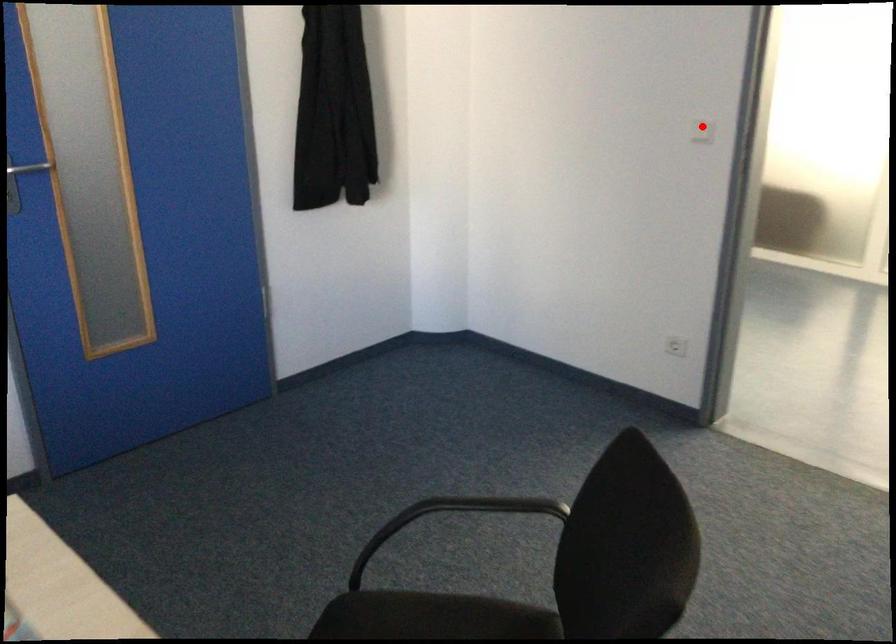
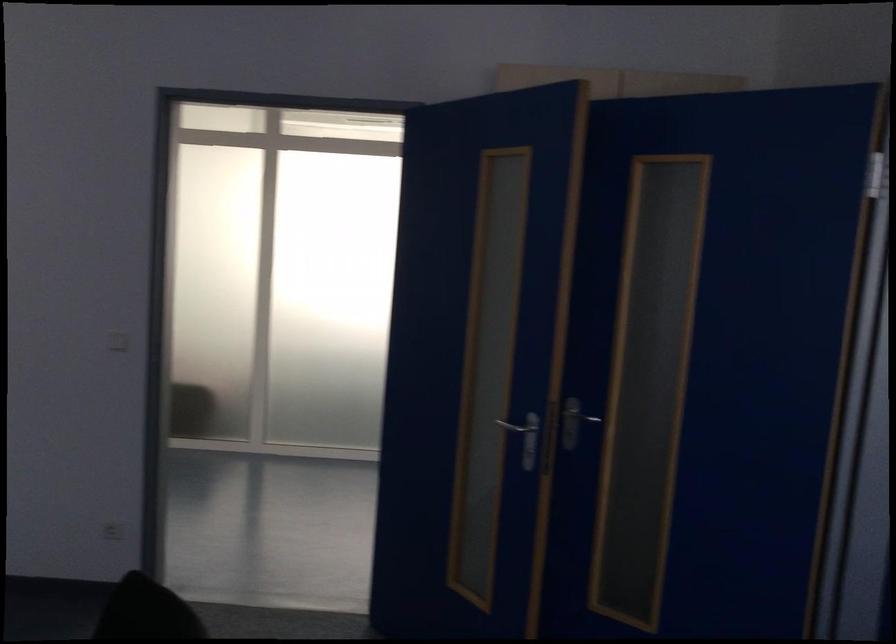
Question: I am providing you with two images of the same scene from different viewpoints. A red point is shown in image1. For the corresponding object point in image2, is it positioned nearer or farther from the camera?

Choices:
 (A) Nearer
 (B) Farther

Answer: (B)